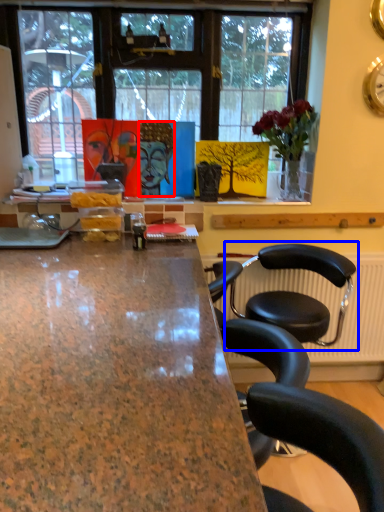
Question: Among these objects, which one is farthest to the camera, person (highlighted by a red box) or chair (highlighted by a blue box)?

Choices:
 (A) person
 (B) chair

Answer: (A)